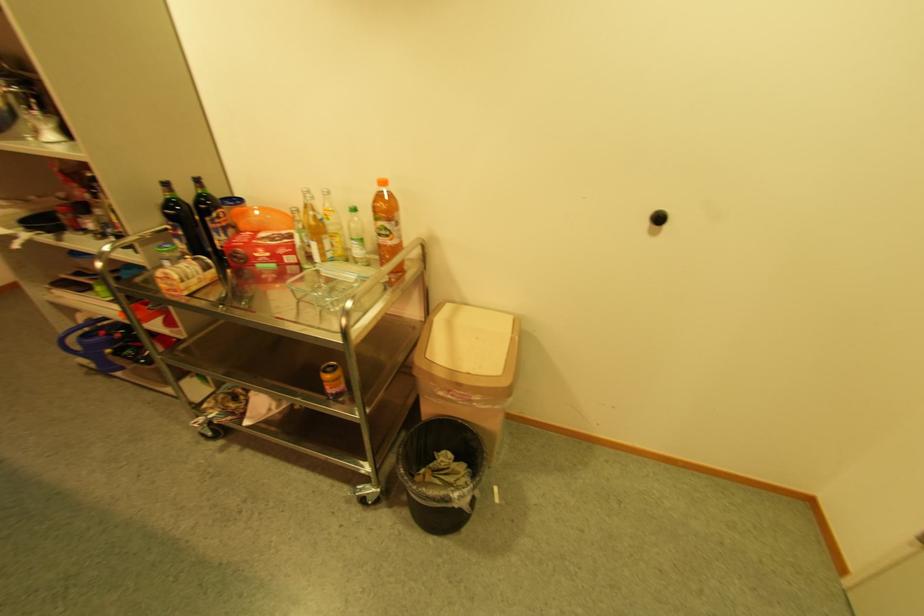
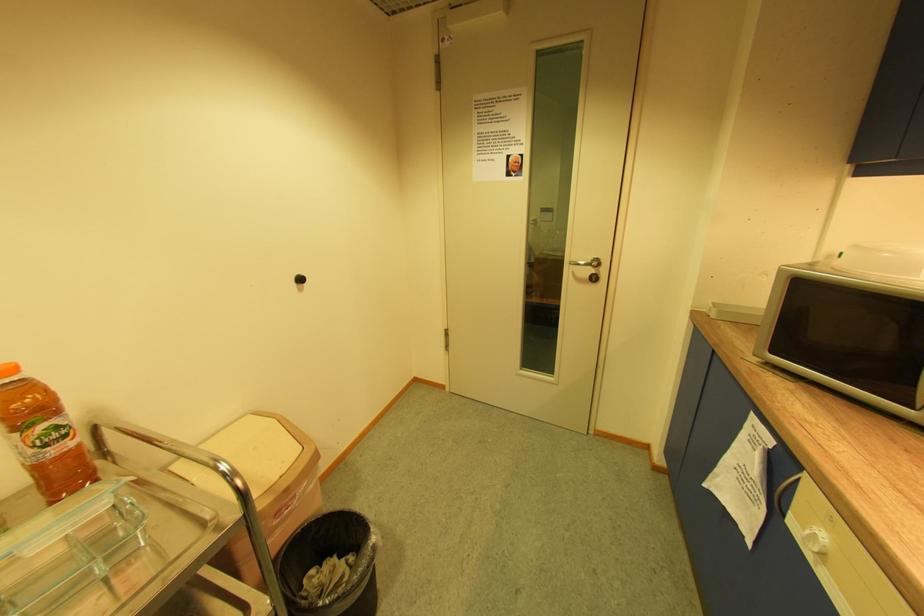
Where in the second image is the point corresponding to pixel 464 423 from the first image?

(304, 533)